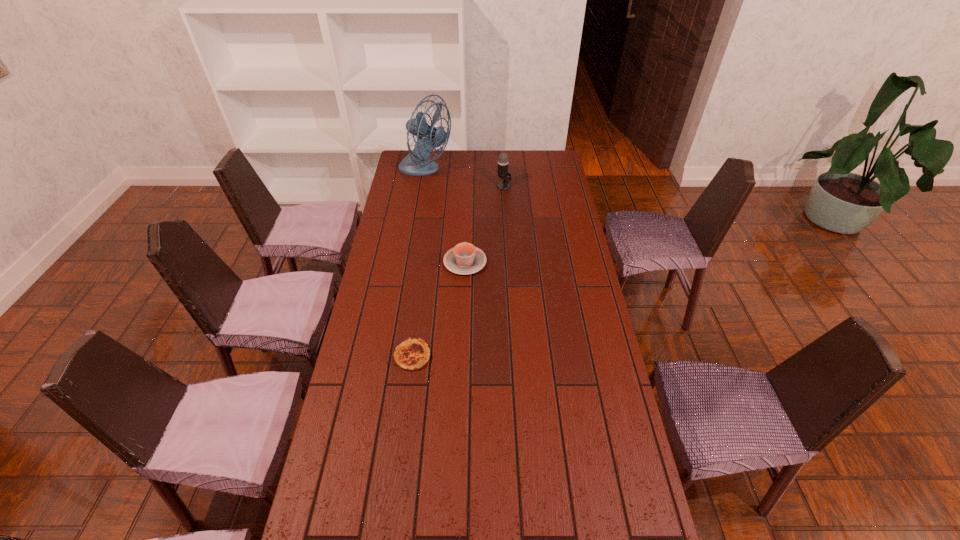
You are a GUI agent. You are given a task and a screenshot of the screen. Output one action in this format:
    pyautogui.click(x=<x>, y=<y>)
    Task: Click on the free point that satisfies the following two spatial constraints: 1. in front of the tallest object to blow air; 2. on the handle side of the second nearest object
    The width and height of the screenshot is (960, 540).
    Given the screenshot: What is the action you would take?
    (410, 262)